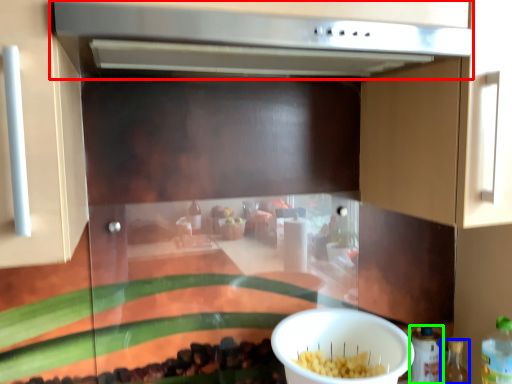
Question: Based on their relative distances, which object is farther from vent (highlighted by a red box)? Choose from bottle (highlighted by a blue box) and bottle (highlighted by a green box).

Choices:
 (A) bottle
 (B) bottle

Answer: (A)